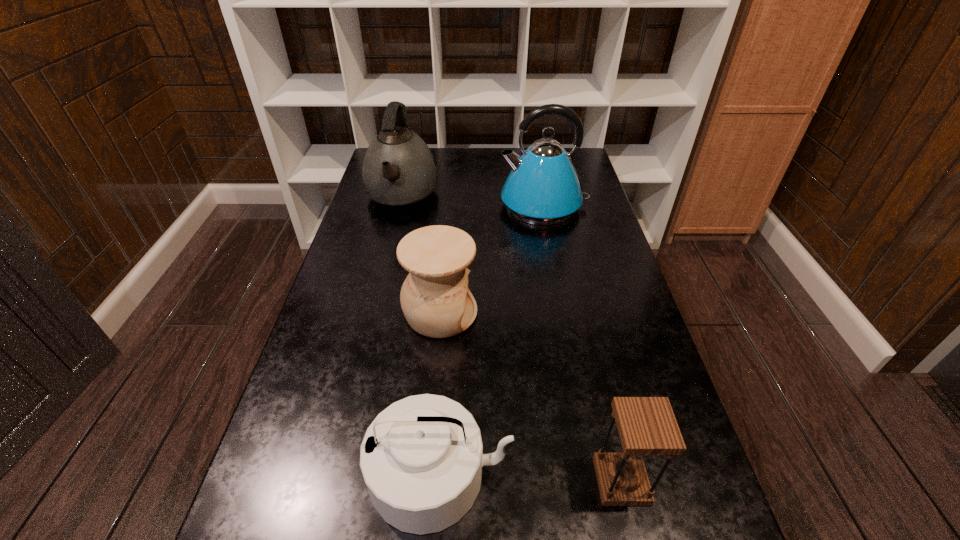
Identify the location of the rightmost kettle. The height and width of the screenshot is (540, 960). (543, 188).

I want to click on the third nearest object, so click(x=435, y=299).

Identify the location of hourglass. The width and height of the screenshot is (960, 540). (647, 426).

Where is `the shortest kettle`? The width and height of the screenshot is (960, 540). the shortest kettle is located at coordinates (422, 459).

Find the location of a particular element. free location located 0.320m at the spout of the rightmost kettle is located at coordinates (403, 205).

Where is `vacant space located 0.140m at the spout of the rightmost kettle`? The width and height of the screenshot is (960, 540). vacant space located 0.140m at the spout of the rightmost kettle is located at coordinates (457, 205).

I want to click on free space located 0.380m at the spout of the rightmost kettle, so click(385, 205).

Identify the location of free space located at the open side of the third nearest object. (558, 313).

Where is `free space located 0.190m on the back of the hourglass`? The width and height of the screenshot is (960, 540). free space located 0.190m on the back of the hourglass is located at coordinates (596, 374).

Where is `object that is at the far edge`? This screenshot has width=960, height=540. object that is at the far edge is located at coordinates (399, 173).